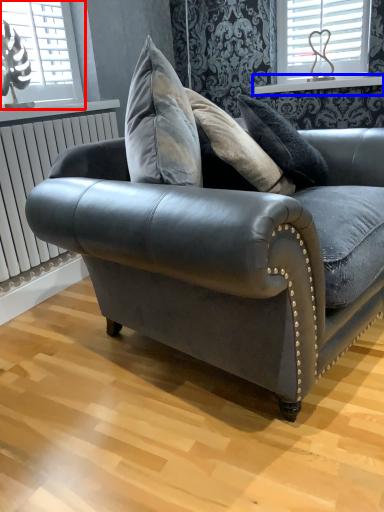
Question: Which object is further to the camera taking this photo, window (highlighted by a red box) or window sill (highlighted by a blue box)?

Choices:
 (A) window
 (B) window sill

Answer: (B)